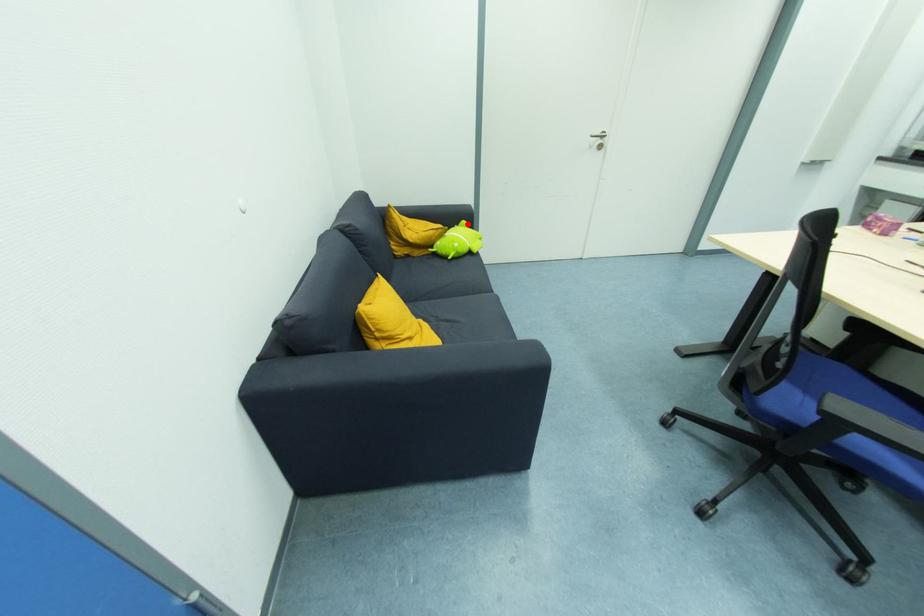
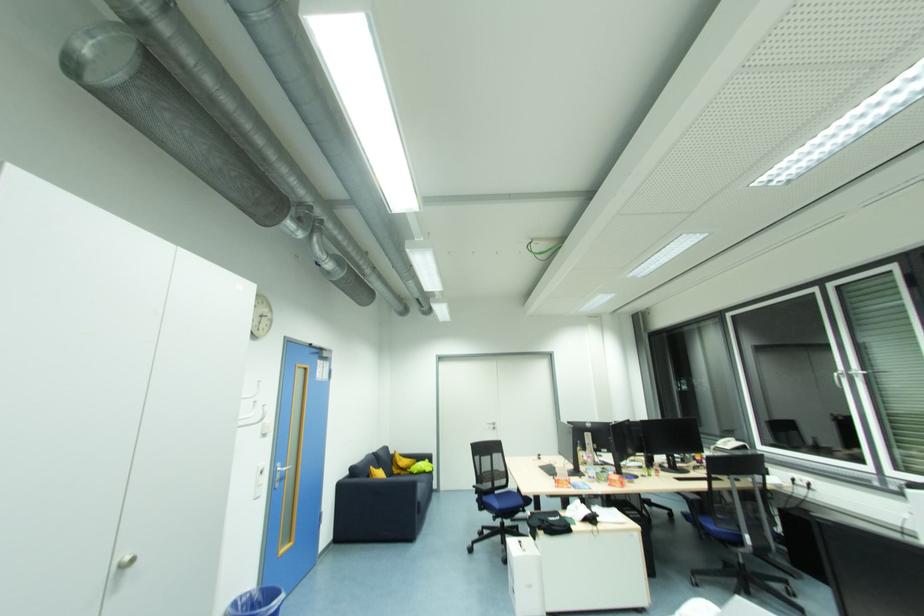
Question: I am providing you with two images of the same scene from different viewpoints. A red point is marked on the first image. Is the red point's position out of view in image 2?

Choices:
 (A) Yes
 (B) No

Answer: (B)